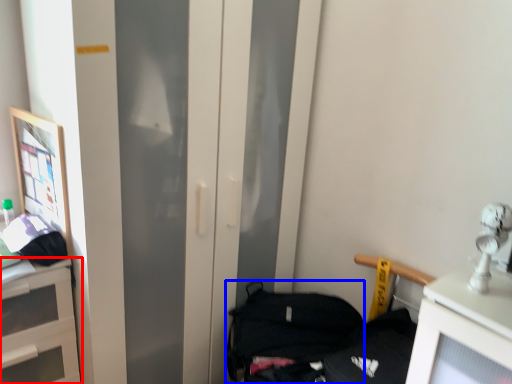
Question: Which point is further to the camera, cabinetry (highlighted by a red box) or handbag (highlighted by a blue box)?

Choices:
 (A) cabinetry
 (B) handbag

Answer: (B)